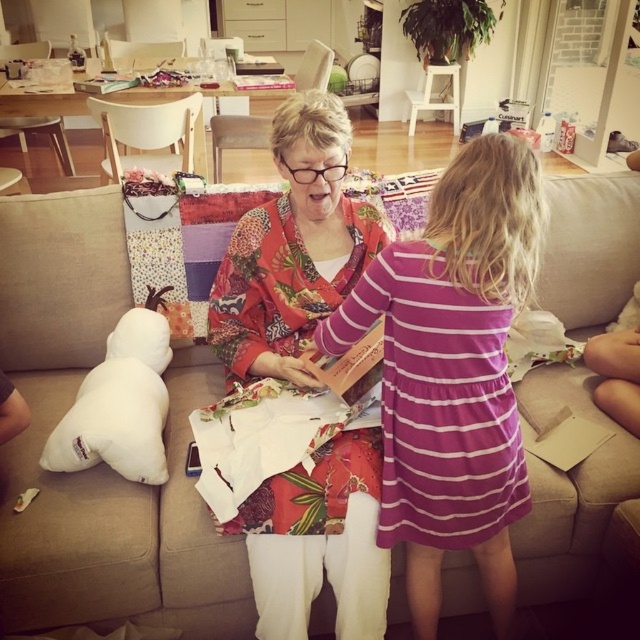
Is point (64, 260) positioned in front of point (58, 428)?

That is False.

Measure the distance between point (627,220) and camera.

Point (627,220) is 6.35 feet from camera.

This screenshot has width=640, height=640. In order to click on beige fabric couch at center in this screenshot , I will do click(100, 465).

Does point (472, 540) come behind point (278, 508)?

No, (472, 540) is in front of (278, 508).

Between purple striped dress at center and floral fabric shawl at center, which one appears on the right side from the viewer's perspective?

purple striped dress at center is more to the right.

Is point (458, 481) more distant than point (225, 362)?

No, it is in front of (225, 362).

Identify the location of purple striped dress at center. (452, 371).

I want to click on beige fabric couch at center, so click(x=100, y=465).

Is beige fabric couch at center bigger than purple striped dress at center?

Correct, beige fabric couch at center is larger in size than purple striped dress at center.

Where is `beige fabric couch at center`? Image resolution: width=640 pixels, height=640 pixels. beige fabric couch at center is located at coordinates (100, 465).

Locate an element on the screen. beige fabric couch at center is located at coordinates (100, 465).